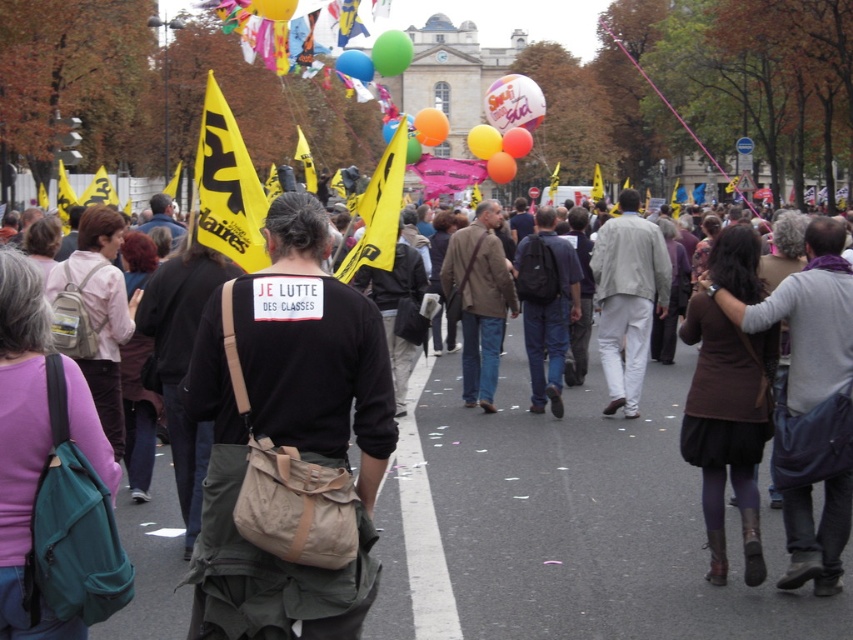
Does dark brown leather jacket at center appear on the left side of yellow paper flag at upper center?

No, dark brown leather jacket at center is not to the left of yellow paper flag at upper center.

Between point (497, 548) and point (287, 4), which one is positioned behind?

Point (287, 4)

Describe the element at coordinates (566, 522) in the screenshot. I see `dark brown leather jacket at center` at that location.

The image size is (853, 640). I want to click on dark brown leather jacket at center, so click(566, 522).

Which is below, yellow paper flag at upper center or matte white balloon at center?

Positioned lower is matte white balloon at center.

You are a GUI agent. You are given a task and a screenshot of the screen. Output one action in this format:
    pyautogui.click(x=<x>, y=<y>)
    Task: Click on the yellow paper flag at upper center
    The image size is (853, 640).
    Given the screenshot: What is the action you would take?
    pyautogui.click(x=273, y=8)

Does white glossy balloon at center appear on the left side of orange matte balloon at center?

In fact, white glossy balloon at center is to the right of orange matte balloon at center.

Measure the distance between point [491,115] and camera.

Point [491,115] is 135.00 meters away from camera.

At what (x,y) coordinates should I click in order to perform the action: click on white glossy balloon at center. Please return your answer as a coordinate pair (x, y). Looking at the image, I should click on (514, 102).